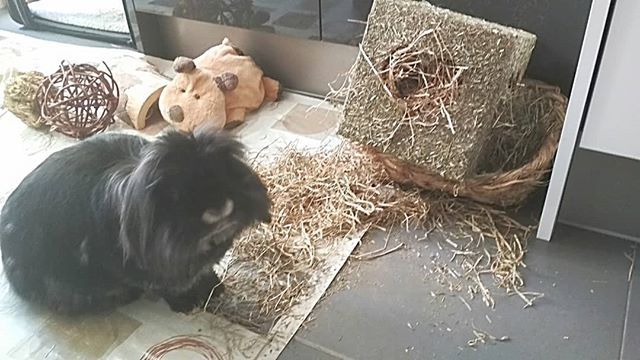
You are a GUI agent. You are given a task and a screenshot of the screen. Output one action in this format:
    pyautogui.click(x=<x>, y=<y>)
    Task: Click on the white wall
    The height and width of the screenshot is (360, 640).
    Given the screenshot: What is the action you would take?
    pyautogui.click(x=620, y=14), pyautogui.click(x=605, y=122), pyautogui.click(x=630, y=131), pyautogui.click(x=627, y=62)